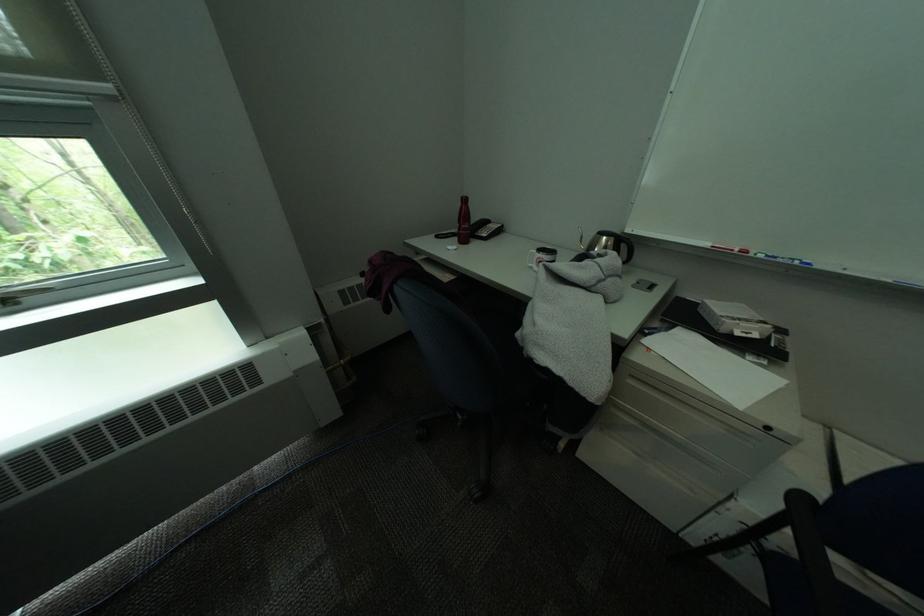
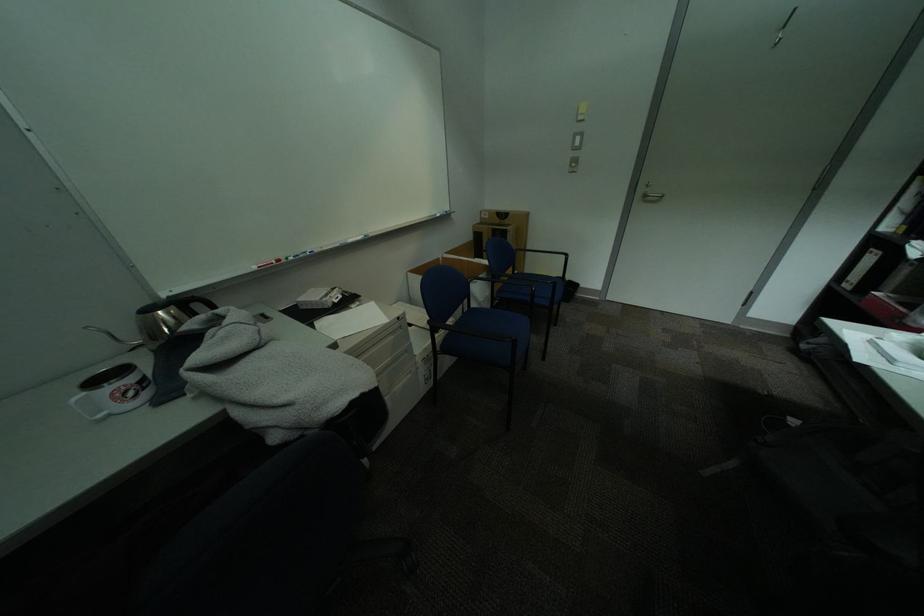
Find the pixel in the second image that matches (x=639, y=240) in the first image.

(204, 297)